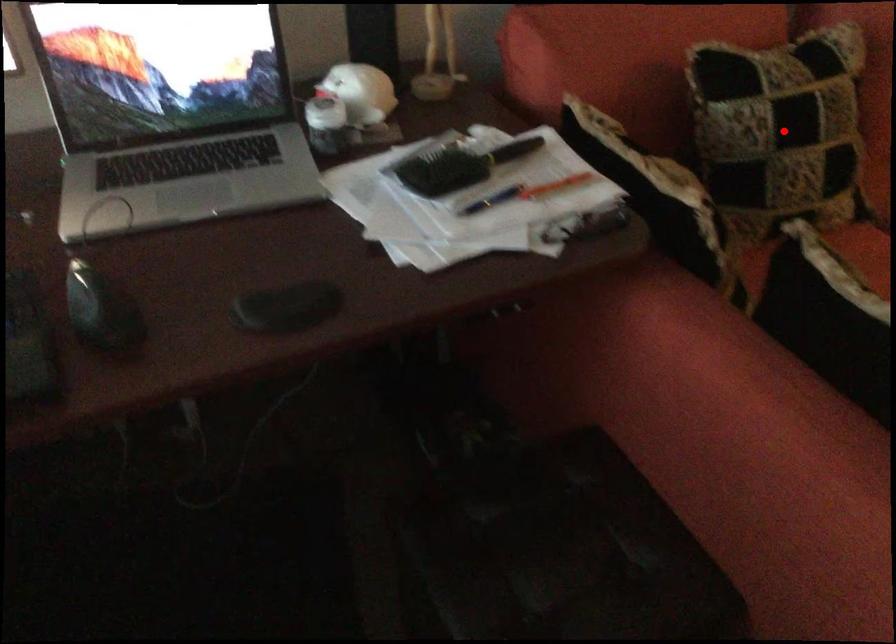
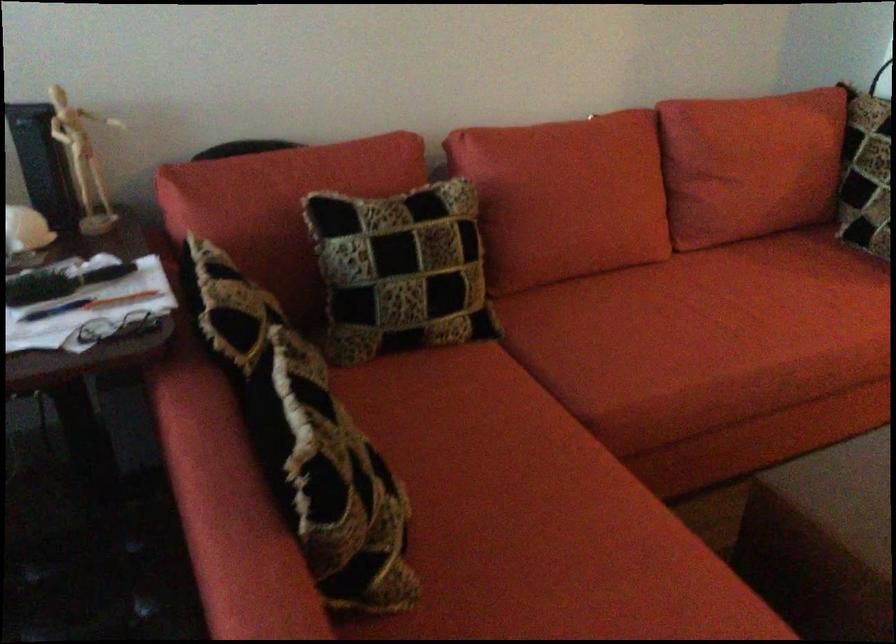
Question: A red point is marked in image1. In image2, is the corresponding 3D point closer to the camera or farther? Reply with the corresponding letter.

Choices:
 (A) The corresponding 3D point is closer.
 (B) The corresponding 3D point is farther.

Answer: (B)